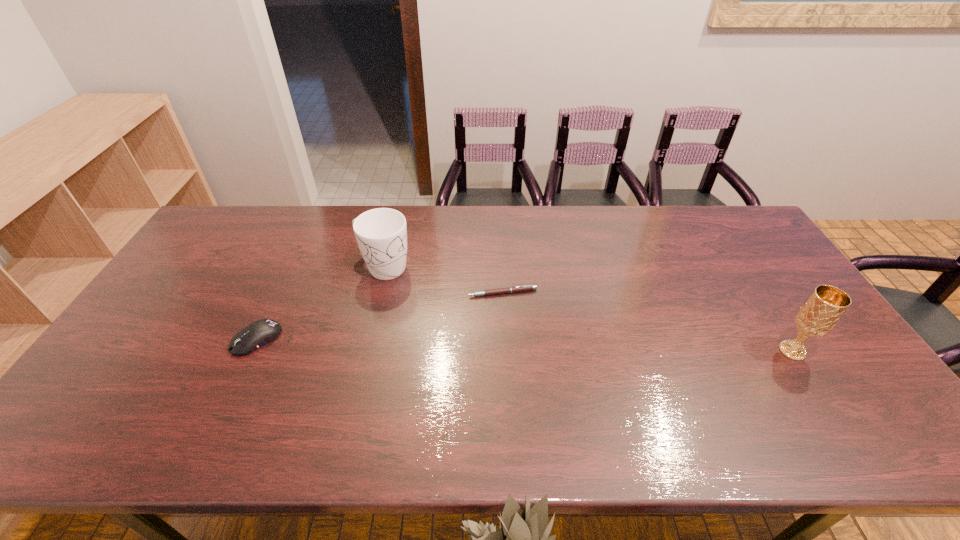
Find the location of a particular element. This screenshot has width=960, height=540. vacant region at the far right corner of the desktop is located at coordinates (711, 211).

Find the location of a particular element. This screenshot has height=540, width=960. vacant area between the third nearest object and the farthest object is located at coordinates (443, 280).

Locate an element on the screen. vacant space that's between the computer equipment and the shortest object is located at coordinates (379, 316).

This screenshot has height=540, width=960. What are the coordinates of `blank region between the mug and the rightmost object` in the screenshot? It's located at (588, 309).

This screenshot has width=960, height=540. Identify the location of unoccupied area between the rightmost object and the farthest object. (588, 309).

Where is `free point between the shortest object and the farthest object`? This screenshot has height=540, width=960. free point between the shortest object and the farthest object is located at coordinates (443, 280).

Identify the location of empty space that is in between the rightmost object and the farthest object. (588, 309).

Where is `free spot between the computer equipment and the mug`? This screenshot has width=960, height=540. free spot between the computer equipment and the mug is located at coordinates (320, 303).

At what (x,y) coordinates should I click in order to perform the action: click on vacant area between the second object from right to left and the chalice. Please return your answer as a coordinate pair (x, y). The image size is (960, 540). Looking at the image, I should click on (647, 322).

The image size is (960, 540). I want to click on blank region between the farthest object and the third nearest object, so click(x=443, y=280).